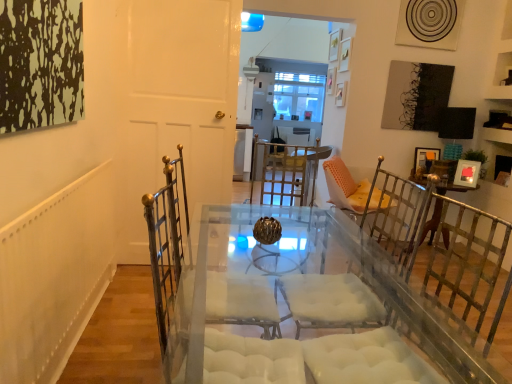
Image resolution: width=512 pixels, height=384 pixels. What do you see at coordinates (424, 160) in the screenshot?
I see `wooden picture frame at right` at bounding box center [424, 160].

The width and height of the screenshot is (512, 384). Identify the location of wooden picture frame at right. (424, 160).

In order to click on white matte door at center in this screenshot , I will do tap(175, 107).

What do you see at coordinates (175, 107) in the screenshot? I see `white matte door at center` at bounding box center [175, 107].

You are a GUI agent. You are given a task and a screenshot of the screen. Output one action in this format:
    pyautogui.click(x=<x>, y=<y>)
    Task: Click on the wooden picture frame at right
    
    Given the screenshot: What is the action you would take?
    pyautogui.click(x=424, y=160)

Which is more to the left, wooden picture frame at right or white matte door at center?

Positioned to the left is white matte door at center.

Considering their positions, is wooden picture frame at right located in front of or behind white matte door at center?

In the image, wooden picture frame at right appears behind white matte door at center.

Is point (423, 163) in front of point (161, 38)?

That is False.

From the image's perspective, which one is positioned higher, wooden picture frame at right or white matte door at center?

white matte door at center appears higher in the image.

From a real-world perspective, which is physically above, wooden picture frame at right or white matte door at center?

white matte door at center is physically above.

Does wooden picture frame at right have a greater width compared to white matte door at center?

No.

Consider the image. Considering the sizes of objects wooden picture frame at right and white matte door at center in the image provided, who is shorter, wooden picture frame at right or white matte door at center?

wooden picture frame at right is shorter.

Considering the sizes of objects wooden picture frame at right and white matte door at center in the image provided, who is smaller, wooden picture frame at right or white matte door at center?

wooden picture frame at right.

Is wooden picture frame at right surrounding white matte door at center?

No, white matte door at center is not surrounded by wooden picture frame at right.

Are wooden picture frame at right and white matte door at center located far from each other?

wooden picture frame at right is far away from white matte door at center.

Is wooden picture frame at right facing away from white matte door at center?

No, wooden picture frame at right's orientation is not away from white matte door at center.

In the image, there is a wooden picture frame at right. What are the coordinates of `door above it (from the image's perspective)` in the screenshot? It's located at (175, 107).

Consider the image. In the image, is white matte door at center on the left side or the right side of wooden picture frame at right?

white matte door at center is positioned on wooden picture frame at right's left side.

From the picture: Considering the relative positions of white matte door at center and wooden picture frame at right in the image provided, is white matte door at center behind wooden picture frame at right?

That is False.

Between point (159, 23) and point (421, 172), which one is positioned behind?

The point (421, 172) is more distant.

From the image's perspective, which one is positioned lower, white matte door at center or wooden picture frame at right?

From the image's view, wooden picture frame at right is below.

From a real-world perspective, is white matte door at center on wooden picture frame at right?

Yes, from a real-world perspective, white matte door at center is above wooden picture frame at right.

Looking at their sizes, would you say white matte door at center is wider or thinner than wooden picture frame at right?

Clearly, white matte door at center has more width compared to wooden picture frame at right.

In the scene shown: Is white matte door at center shorter than wooden picture frame at right?

In fact, white matte door at center may be taller than wooden picture frame at right.

Can you confirm if white matte door at center is bigger than wooden picture frame at right?

Yes, white matte door at center is bigger than wooden picture frame at right.

Is wooden picture frame at right surrounded by white matte door at center?

No, wooden picture frame at right is not inside white matte door at center.

Is white matte door at center far away from wooden picture frame at right?

Absolutely, white matte door at center is distant from wooden picture frame at right.

Is white matte door at center facing towards wooden picture frame at right?

No, white matte door at center is not facing towards wooden picture frame at right.

How many degrees apart are the facing directions of white matte door at center and wooden picture frame at right?

white matte door at center and wooden picture frame at right are facing 175 degrees away from each other.

How much distance is there between white matte door at center and wooden picture frame at right?

white matte door at center and wooden picture frame at right are 2.38 meters apart from each other.

The width and height of the screenshot is (512, 384). I want to click on door above the wooden picture frame at right (from a real-world perspective), so click(x=175, y=107).

Locate an element on the screen. picture frame located below the white matte door at center (from the image's perspective) is located at coordinates (424, 160).

Identify the location of picture frame on the right of white matte door at center. (424, 160).